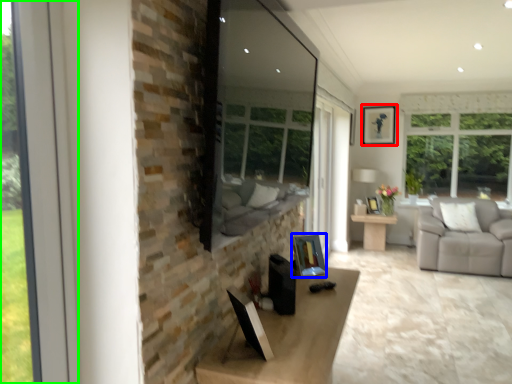
Question: Considering the real-world distances, which object is farthest from picture frame (highlighted by a red box)? picture frame (highlighted by a blue box) or window (highlighted by a green box)?

Choices:
 (A) picture frame
 (B) window

Answer: (B)